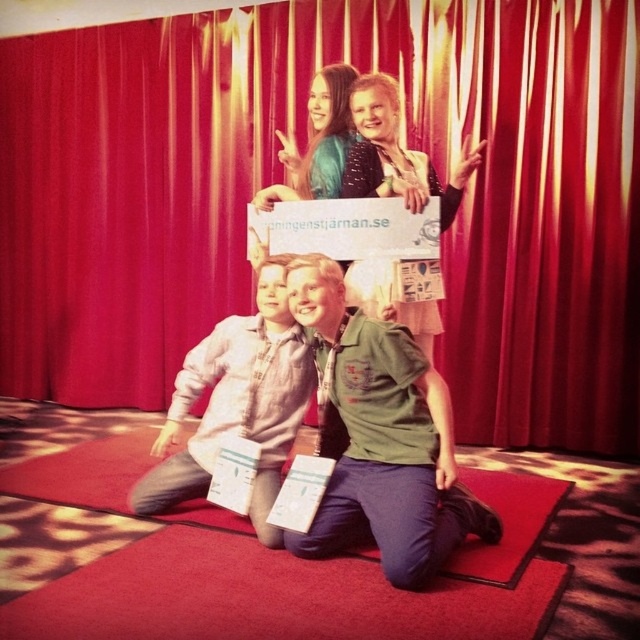
Question: Which of the following is the farthest from the observer?

Choices:
 (A) green uniform at center
 (B) matte black jacket at center

Answer: (B)

Question: Can you confirm if red velvet curtain at upper center is positioned below matte black jacket at center?

Choices:
 (A) yes
 (B) no

Answer: (B)

Question: Does green uniform at center appear on the left side of light gray cotton shirt at center?

Choices:
 (A) yes
 (B) no

Answer: (B)

Question: Which of the following is the farthest from the observer?

Choices:
 (A) (349, 330)
 (B) (72, 241)

Answer: (B)

Question: Is red velvet curtain at upper center further to the viewer compared to matte black jacket at center?

Choices:
 (A) yes
 (B) no

Answer: (A)

Question: Which object is the closest to the green uniform at center?

Choices:
 (A) light gray cotton shirt at center
 (B) red velvet curtain at upper center
 (C) matte black jacket at center

Answer: (A)